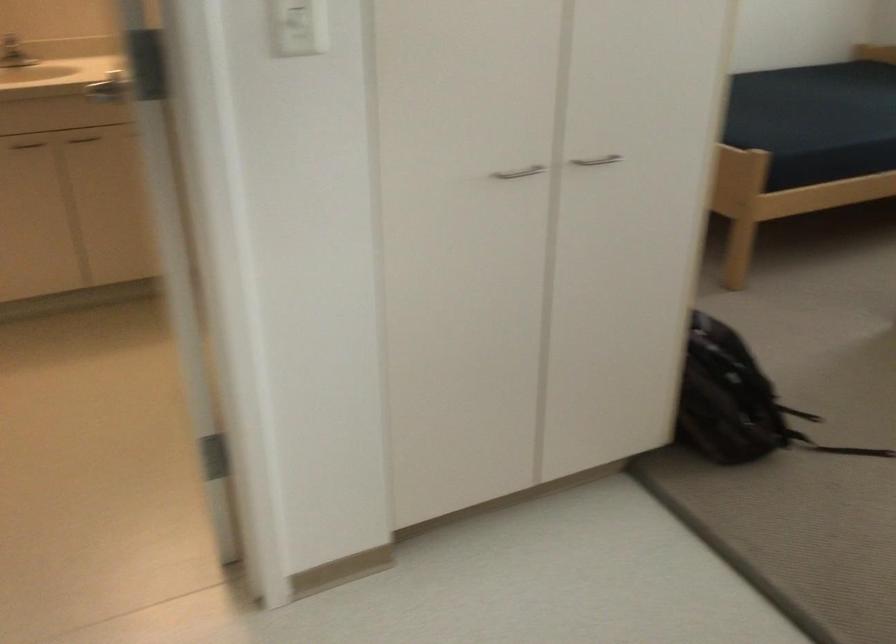
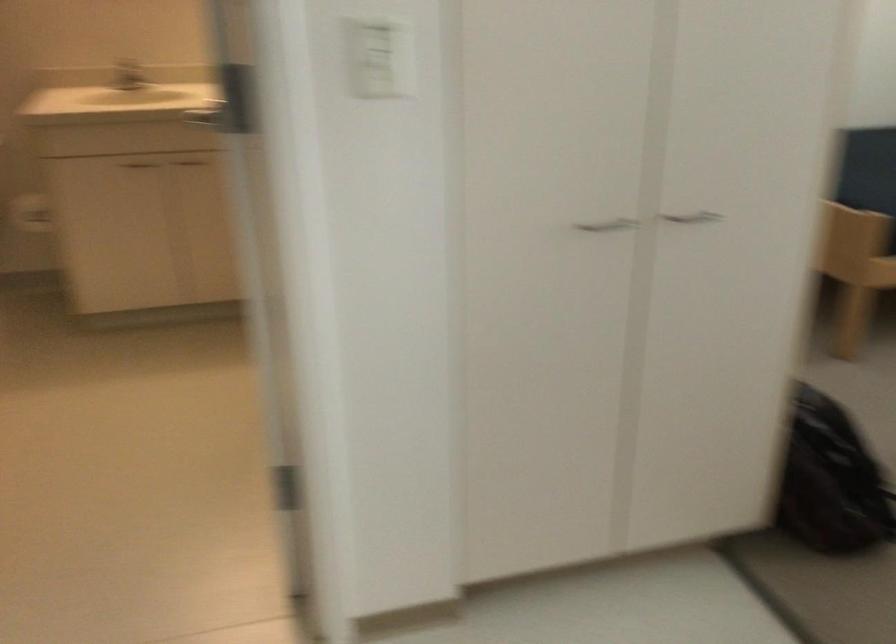
Find the pixel in the second image that matches (733,399) in the first image.

(831, 480)